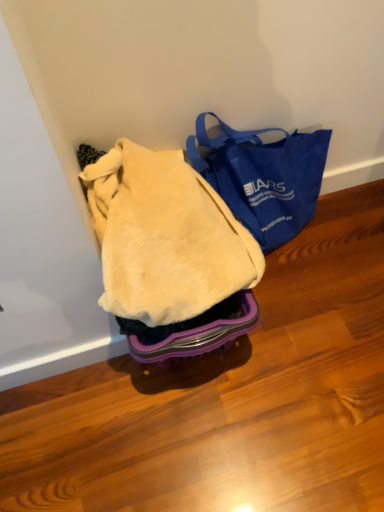
Identify the location of beige fuzzy blanket at center. This screenshot has width=384, height=512. (165, 237).

The height and width of the screenshot is (512, 384). Describe the element at coordinates (165, 237) in the screenshot. I see `beige fuzzy blanket at center` at that location.

What are the coordinates of `beige fuzzy blanket at center` in the screenshot? It's located at (165, 237).